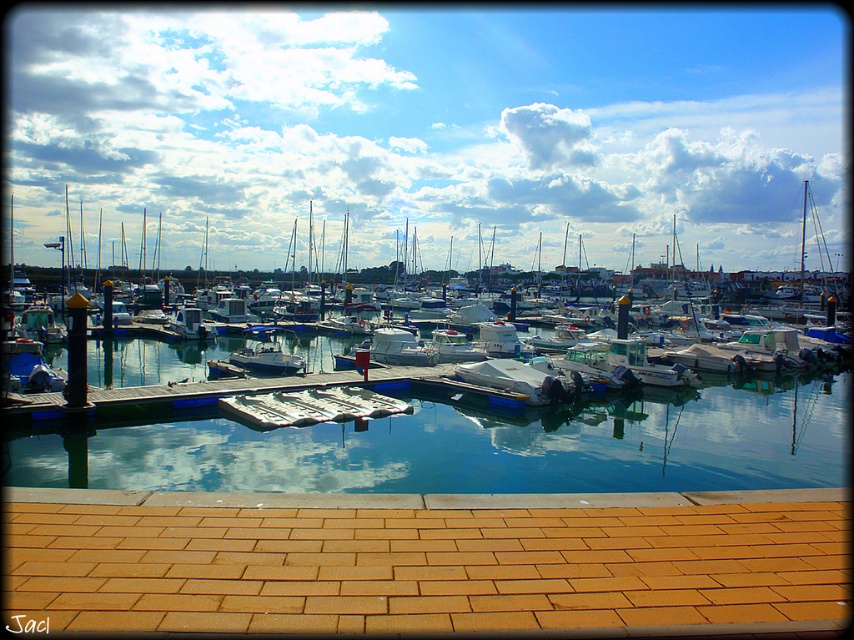
You are standing on the paved walkway at the foreground of the marina scene. You want to take a photo of the clear glass water at center. Where should you position yourself to capture it in the frame?

To capture the clear glass water at center in your photo, position yourself so that the camera is aligned with the coordinates point (478, 448), which is the 2D location of the clear glass water at center.

From the picture: You are a dock worker who needs to determine which boat to secure first based on size. The white matte boat at center and the white glossy motorboat at center are both in need of mooring. Which boat requires more space due to its size?

The white matte boat at center requires more space because it is bigger than the white glossy motorboat at center.